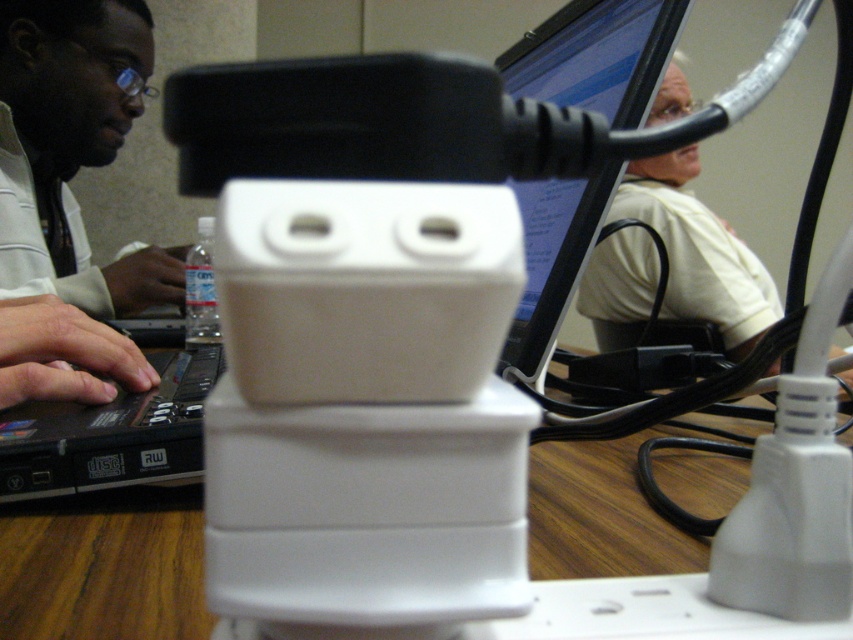
Question: Which point appears farthest from the camera in this image?

Choices:
 (A) (614, 196)
 (B) (77, 604)

Answer: (A)

Question: Which object is the closest to the white matte shirt at upper right?

Choices:
 (A) matte black hands at left
 (B) matte black laptop at left
 (C) wooden table at center

Answer: (B)

Question: Is white matte shirt at upper right positioned behind matte black hands at left?

Choices:
 (A) no
 (B) yes

Answer: (B)

Question: Does matte black laptop at left have a smaller size compared to white matte shirt at upper right?

Choices:
 (A) yes
 (B) no

Answer: (B)

Question: Estimate the real-world distances between objects in this image. Which object is farther from the matte black laptop at left?

Choices:
 (A) white matte shirt at upper right
 (B) matte black hands at left
 (C) wooden table at center

Answer: (C)

Question: Does matte black laptop at left appear on the right side of wooden table at center?

Choices:
 (A) yes
 (B) no

Answer: (B)